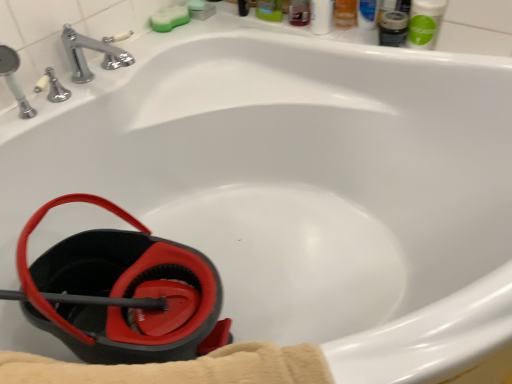
Question: From a real-world perspective, is matte black mouthwash at upper right, which appears as the first mouthwash when viewed from the left, located higher than green sponge at upper center?

Choices:
 (A) no
 (B) yes

Answer: (B)

Question: Does matte black mouthwash at upper right, which appears as the second mouthwash when viewed from the right, appear on the right side of green sponge at upper center?

Choices:
 (A) no
 (B) yes

Answer: (B)

Question: From a real-world perspective, is matte black mouthwash at upper right, which appears as the first mouthwash when viewed from the left, located beneath green sponge at upper center?

Choices:
 (A) no
 (B) yes

Answer: (A)

Question: Is the position of matte black mouthwash at upper right, which appears as the second mouthwash when viewed from the right, less distant than that of green sponge at upper center?

Choices:
 (A) no
 (B) yes

Answer: (B)

Question: Does matte black mouthwash at upper right, which appears as the first mouthwash when viewed from the left, lie behind green sponge at upper center?

Choices:
 (A) yes
 (B) no

Answer: (B)

Question: Is matte black mouthwash at upper right, which appears as the second mouthwash when viewed from the right, smaller than green sponge at upper center?

Choices:
 (A) no
 (B) yes

Answer: (A)

Question: Does green sponge at upper center come in front of green matte mouthwash at upper right, the first mouthwash positioned from the right?

Choices:
 (A) yes
 (B) no

Answer: (B)

Question: Is green sponge at upper center in contact with green matte mouthwash at upper right, which is the 2th mouthwash in left-to-right order?

Choices:
 (A) no
 (B) yes

Answer: (A)

Question: Does green sponge at upper center appear on the left side of green matte mouthwash at upper right, which is the 2th mouthwash in left-to-right order?

Choices:
 (A) yes
 (B) no

Answer: (A)

Question: Is green sponge at upper center further to camera compared to green matte mouthwash at upper right, which is the 2th mouthwash in left-to-right order?

Choices:
 (A) no
 (B) yes

Answer: (B)

Question: Does green sponge at upper center have a greater width compared to green matte mouthwash at upper right, which is the 2th mouthwash in left-to-right order?

Choices:
 (A) no
 (B) yes

Answer: (A)

Question: From a real-world perspective, does green sponge at upper center stand above green matte mouthwash at upper right, the first mouthwash positioned from the right?

Choices:
 (A) no
 (B) yes

Answer: (A)

Question: Is matte black mouthwash at upper right, which appears as the first mouthwash when viewed from the left, facing towards green matte mouthwash at upper right, the first mouthwash positioned from the right?

Choices:
 (A) yes
 (B) no

Answer: (B)